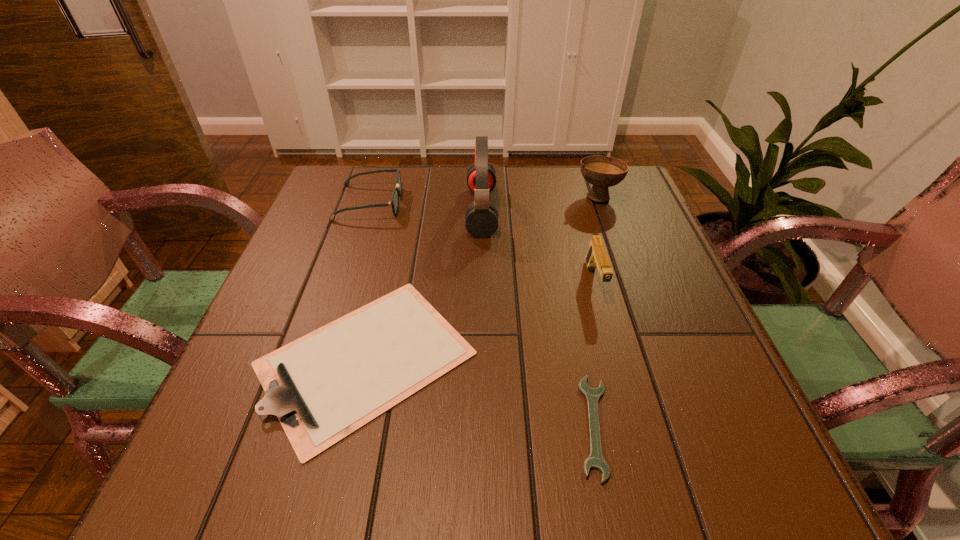
At what (x,y) coordinates should I click in order to perform the action: click on clipboard at the near edge. Please return your answer as a coordinate pair (x, y). Looking at the image, I should click on (323, 387).

Where is `wrench that is at the near edge`? The height and width of the screenshot is (540, 960). wrench that is at the near edge is located at coordinates (595, 460).

This screenshot has width=960, height=540. What are the coordinates of `spectacles at the left edge` in the screenshot? It's located at (394, 202).

Where is `clipboard that is at the left edge`? The height and width of the screenshot is (540, 960). clipboard that is at the left edge is located at coordinates (323, 387).

At what (x,y) coordinates should I click in order to perform the action: click on object at the right edge. Please return your answer as a coordinate pair (x, y). This screenshot has width=960, height=540. Looking at the image, I should click on (602, 172).

The image size is (960, 540). What are the coordinates of `object that is at the far left corner` in the screenshot? It's located at (394, 202).

Locate an element on the screen. The height and width of the screenshot is (540, 960). object that is at the near left corner is located at coordinates (323, 387).

This screenshot has height=540, width=960. What are the coordinates of `object that is at the far right corner` in the screenshot? It's located at (602, 172).

This screenshot has height=540, width=960. I want to click on vacant region at the far edge of the desktop, so click(x=529, y=185).

Where is `free spot at the near edge of the desktop`? free spot at the near edge of the desktop is located at coordinates (661, 472).